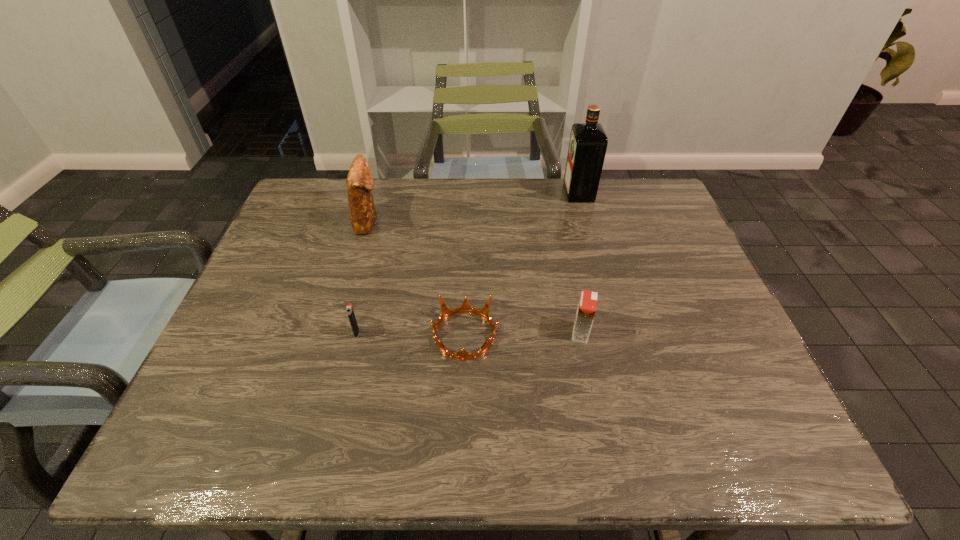
Locate an element on the screen. free spot that satisfies the following two spatial constraints: 1. on the open side of the crown; 2. on the left side of the clutch bag is located at coordinates (334, 335).

At what (x,y) coordinates should I click in order to perform the action: click on vacant position in the image that satisfies the following two spatial constraints: 1. on the back side of the crown; 2. on the open side of the second farthest object. Please return your answer as a coordinate pair (x, y). Image resolution: width=960 pixels, height=540 pixels. Looking at the image, I should click on (468, 220).

Locate an element on the screen. vacant region that satisfies the following two spatial constraints: 1. on the back side of the fourth tallest object; 2. on the open side of the fourth nearest object is located at coordinates (384, 220).